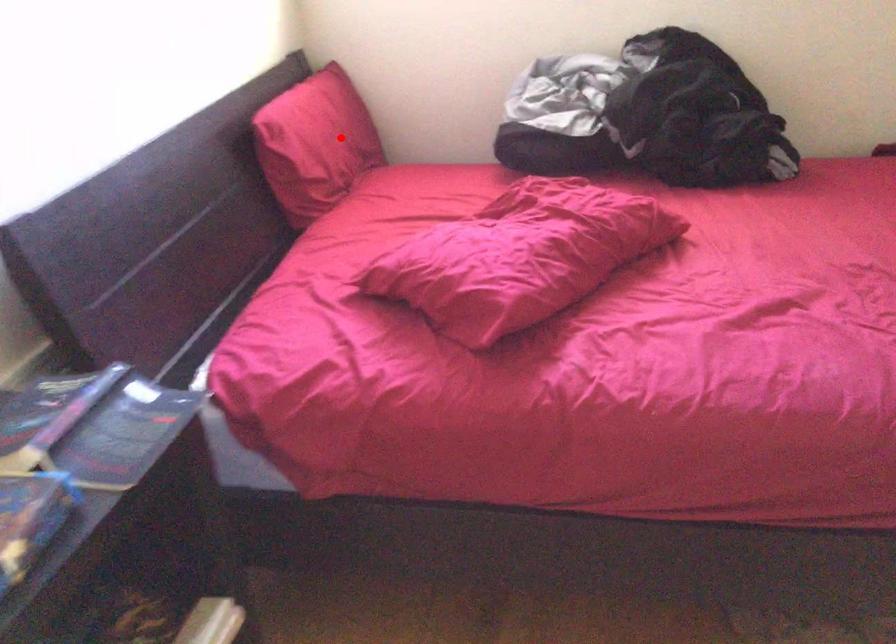
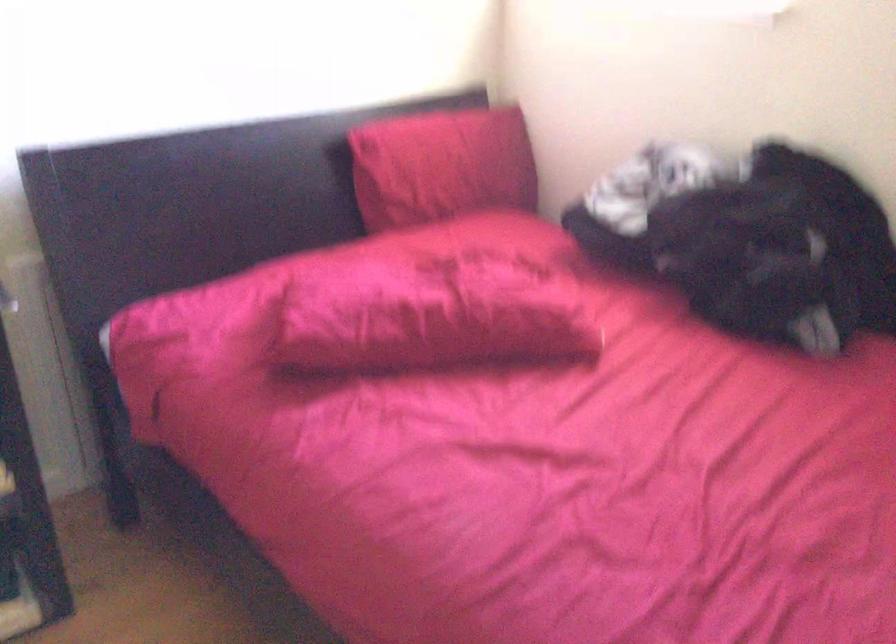
Where in the second image is the point corresponding to the highlighted location from the first image?

(442, 166)